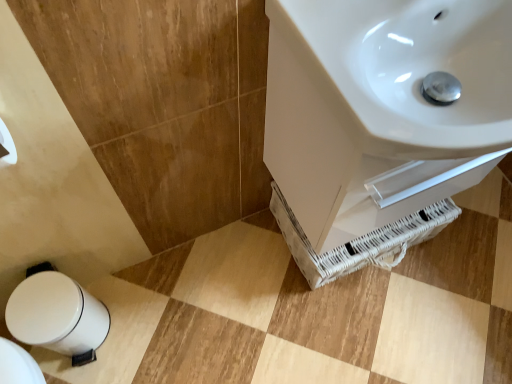
Question: Does white glossy trash can at lower left come in front of white glossy sink at upper right?

Choices:
 (A) no
 (B) yes

Answer: (A)

Question: Can you confirm if white glossy trash can at lower left is positioned to the left of white glossy sink at upper right?

Choices:
 (A) no
 (B) yes

Answer: (B)

Question: From a real-world perspective, does white glossy trash can at lower left stand above white glossy sink at upper right?

Choices:
 (A) no
 (B) yes

Answer: (A)

Question: Could white glossy sink at upper right be considered to be inside white glossy trash can at lower left?

Choices:
 (A) yes
 (B) no

Answer: (B)

Question: From the image's perspective, would you say white glossy trash can at lower left is positioned over white glossy sink at upper right?

Choices:
 (A) yes
 (B) no

Answer: (B)

Question: Is white glossy trash can at lower left facing towards white glossy sink at upper right?

Choices:
 (A) no
 (B) yes

Answer: (A)

Question: Is white glossy sink at upper right taller than white glossy trash can at lower left?

Choices:
 (A) yes
 (B) no

Answer: (B)

Question: Does white glossy sink at upper right have a smaller size compared to white glossy trash can at lower left?

Choices:
 (A) yes
 (B) no

Answer: (B)

Question: Does white glossy sink at upper right contain white glossy trash can at lower left?

Choices:
 (A) no
 (B) yes

Answer: (A)

Question: Is white glossy sink at upper right thinner than white glossy trash can at lower left?

Choices:
 (A) no
 (B) yes

Answer: (A)

Question: Does white glossy sink at upper right have a greater width compared to white glossy trash can at lower left?

Choices:
 (A) no
 (B) yes

Answer: (B)

Question: Is white glossy sink at upper right facing away from white glossy trash can at lower left?

Choices:
 (A) no
 (B) yes

Answer: (A)

Question: Would you say white glossy sink at upper right is inside or outside white glossy trash can at lower left?

Choices:
 (A) outside
 (B) inside

Answer: (A)